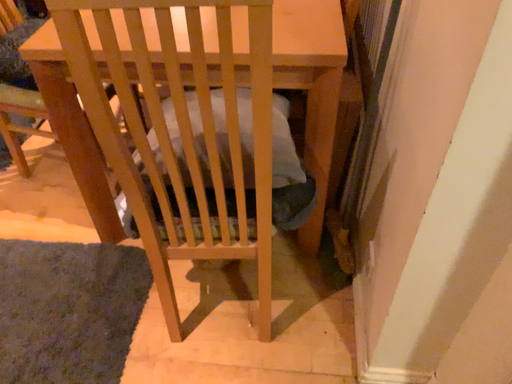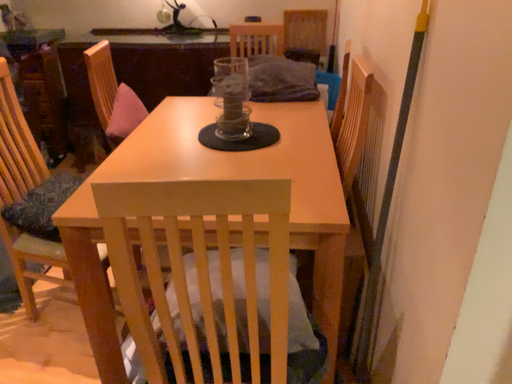
Question: How did the camera likely rotate when shooting the video?

Choices:
 (A) rotated downward
 (B) rotated upward

Answer: (B)